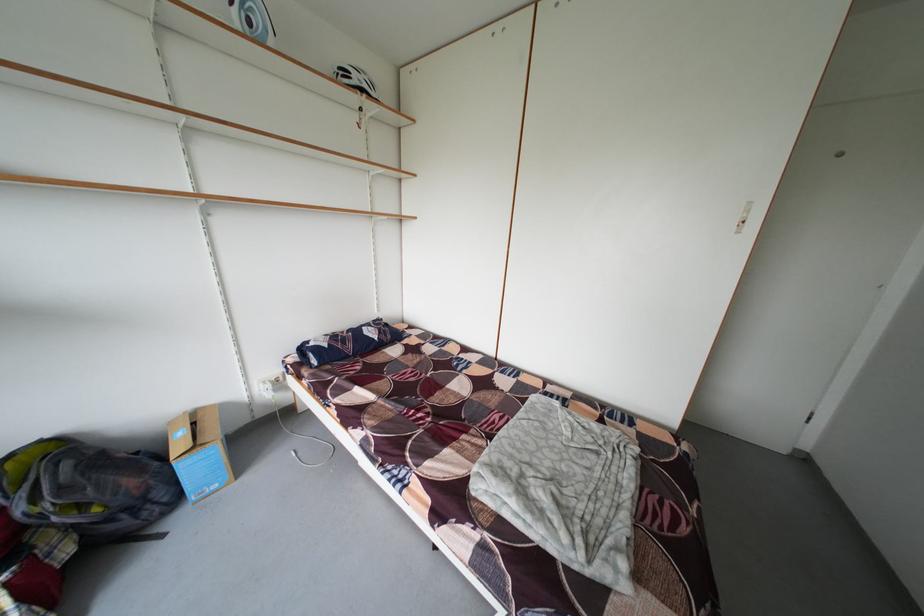
The location [356,79] corresponds to which object?

It corresponds to the white bicycle helmet in the image.